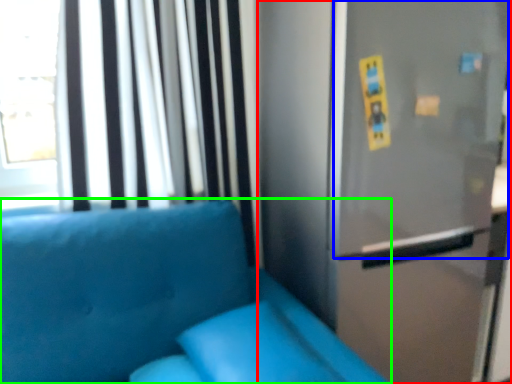
Question: Which object is positioned farthest from fridge (highlighted by a red box)? Select from screen door (highlighted by a blue box) and furniture (highlighted by a green box).

Choices:
 (A) screen door
 (B) furniture

Answer: (B)